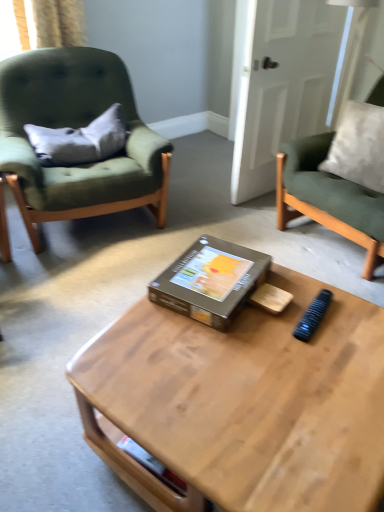
The width and height of the screenshot is (384, 512). I want to click on blank space situated above wooden coffee table at center (from a real-world perspective), so click(268, 358).